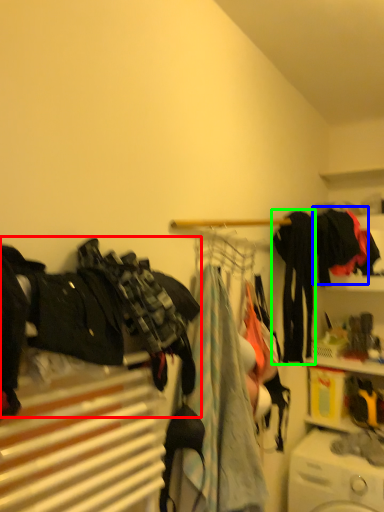
Question: Which object is positioned closest to clothing (highlighted by a red box)? Select from clothing (highlighted by a blue box) and clothing (highlighted by a green box).

Choices:
 (A) clothing
 (B) clothing

Answer: (B)